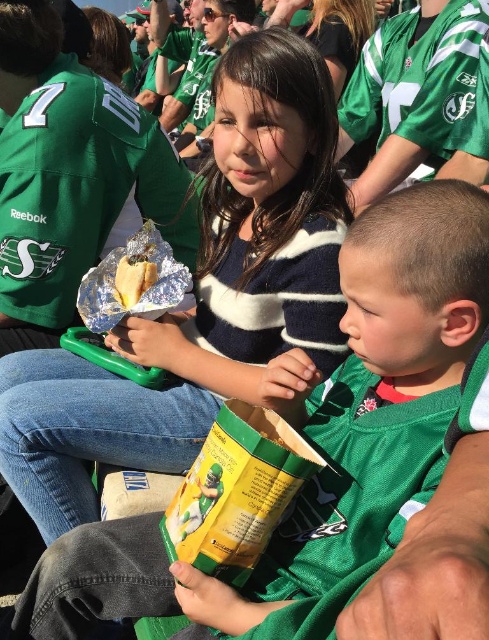
Question: Considering the real-world distances, which object is closest to the shiny foil burrito at center?

Choices:
 (A) striped sweater at center
 (B) green matte jersey at center

Answer: (A)

Question: Can you confirm if green matte jersey at center is bigger than striped sweater at center?

Choices:
 (A) yes
 (B) no

Answer: (B)

Question: Among these objects, which one is farthest from the camera?

Choices:
 (A) striped sweater at center
 (B) shiny foil burrito at center
 (C) green matte jersey at center

Answer: (B)

Question: Does striped sweater at center lie behind shiny foil burrito at center?

Choices:
 (A) no
 (B) yes

Answer: (A)

Question: Is green matte jersey at center positioned in front of shiny foil burrito at center?

Choices:
 (A) no
 (B) yes

Answer: (B)

Question: Which object is the farthest from the shiny foil burrito at center?

Choices:
 (A) striped sweater at center
 (B) green matte jersey at center

Answer: (B)